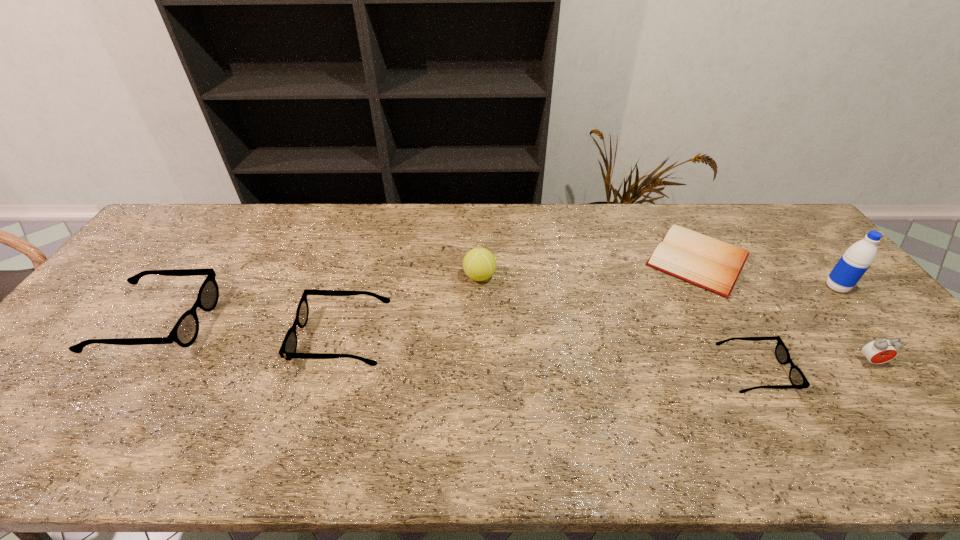
Choose which object is the sixth nearest neighbor to the leftmost spectacles. Please provide its 2D coordinates. Your answer should be formatted as a tuple, i.e. [(x, y)], where the tuple contains the x and y coordinates of a point satisfying the conditions above.

[(857, 259)]

Locate which spectacles is the closest to the second object from left to right. Please provide its 2D coordinates. Your answer should be formatted as a tuple, i.e. [(x, y)], where the tuple contains the x and y coordinates of a point satisfying the conditions above.

[(184, 333)]

Select which spectacles is the second closest to the leftmost spectacles. Please provide its 2D coordinates. Your answer should be formatted as a tuple, i.e. [(x, y)], where the tuple contains the x and y coordinates of a point satisfying the conditions above.

[(798, 380)]

Where is `vacant position in the image that satisfies the following two spatial constraints: 1. on the front side of the rightmost object; 2. on the left side of the fifth object from right to left`? vacant position in the image that satisfies the following two spatial constraints: 1. on the front side of the rightmost object; 2. on the left side of the fifth object from right to left is located at coordinates (480, 287).